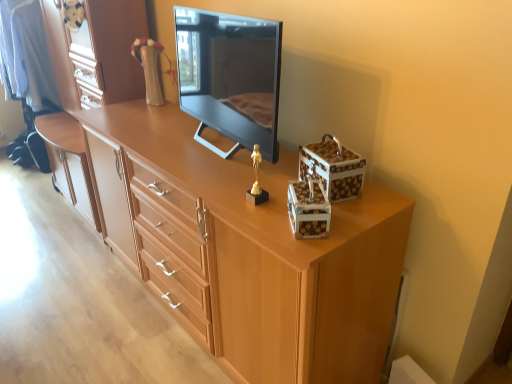
Question: Is black glossy television at center at the back of gold metallic statue at center?

Choices:
 (A) yes
 (B) no

Answer: (B)

Question: Is gold metallic statue at center to the left of black glossy television at center from the viewer's perspective?

Choices:
 (A) yes
 (B) no

Answer: (B)

Question: From a real-world perspective, is gold metallic statue at center over black glossy television at center?

Choices:
 (A) no
 (B) yes

Answer: (A)

Question: From a real-world perspective, is gold metallic statue at center below black glossy television at center?

Choices:
 (A) yes
 (B) no

Answer: (A)

Question: Is gold metallic statue at center to the right of black glossy television at center from the viewer's perspective?

Choices:
 (A) yes
 (B) no

Answer: (A)

Question: Considering the relative sizes of gold metallic statue at center and black glossy television at center in the image provided, is gold metallic statue at center shorter than black glossy television at center?

Choices:
 (A) yes
 (B) no

Answer: (A)

Question: Is white glossy storage box at upper right, placed as the 1th storage box when sorted from back to front, wider than gold metallic statue at center?

Choices:
 (A) yes
 (B) no

Answer: (A)

Question: Can you confirm if white glossy storage box at upper right, placed as the 1th storage box when sorted from back to front, is smaller than gold metallic statue at center?

Choices:
 (A) yes
 (B) no

Answer: (B)

Question: From the image's perspective, would you say white glossy storage box at upper right, placed as the 1th storage box when sorted from back to front, is positioned over gold metallic statue at center?

Choices:
 (A) no
 (B) yes

Answer: (B)

Question: Is white glossy storage box at upper right, placed as the 1th storage box when sorted from back to front, positioned in front of gold metallic statue at center?

Choices:
 (A) yes
 (B) no

Answer: (B)

Question: Are white glossy storage box at upper right, placed as the 1th storage box when sorted from back to front, and gold metallic statue at center located far from each other?

Choices:
 (A) no
 (B) yes

Answer: (A)

Question: Is white glossy storage box at upper right, placed as the 1th storage box when sorted from back to front, facing away from gold metallic statue at center?

Choices:
 (A) no
 (B) yes

Answer: (A)

Question: Can you confirm if black glossy television at center is bigger than white glossy storage box at upper right, the 1th storage box when ordered from front to back?

Choices:
 (A) yes
 (B) no

Answer: (A)